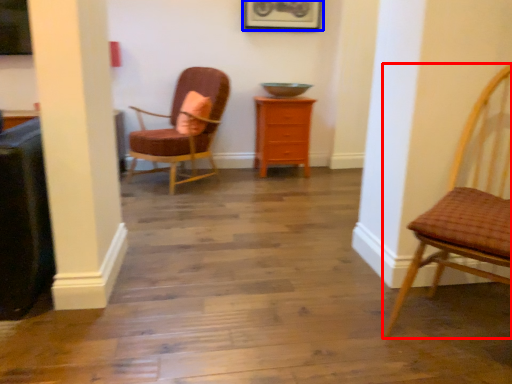
Question: Which point is further to the camera, chair (highlighted by a red box) or picture frame (highlighted by a blue box)?

Choices:
 (A) chair
 (B) picture frame

Answer: (B)